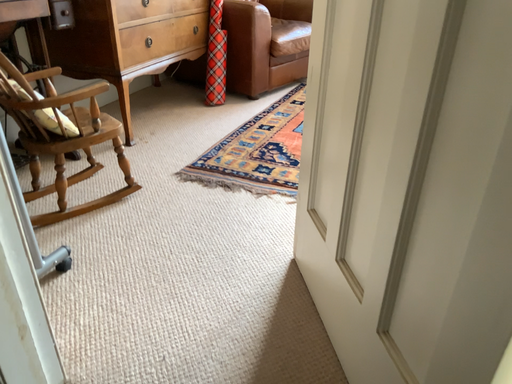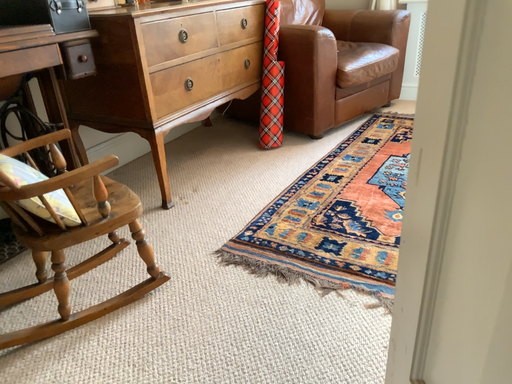
Question: How did the camera likely rotate when shooting the video?

Choices:
 (A) rotated right
 (B) rotated left

Answer: (B)